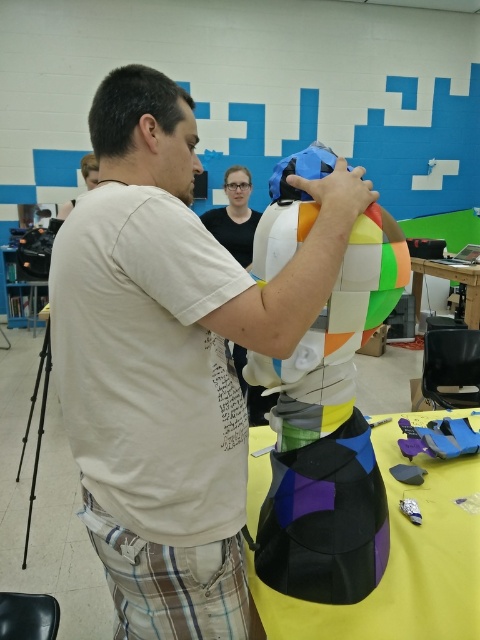
Measure the distance from matte white shirt at center to multicolored paper mache mask at center.

A distance of 6.90 inches exists between matte white shirt at center and multicolored paper mache mask at center.

Between point (230, 513) and point (372, 580), which one is positioned behind?

Point (372, 580)

Find the location of `matte white shirt at center`. matte white shirt at center is located at coordinates (170, 358).

The width and height of the screenshot is (480, 640). What do you see at coordinates (400, 563) in the screenshot?
I see `black fabric table at center` at bounding box center [400, 563].

Is black fabric table at center positioned at the back of yellow matte table at lower right?

That is False.

Identify the location of black fabric table at center. (400, 563).

Between multicolored paper mache mask at center and yellow matte table at lower right, which one has more height?

Standing taller between the two is multicolored paper mache mask at center.

Is multicolored paper mache mask at center wider than yellow matte table at lower right?

No, multicolored paper mache mask at center is not wider than yellow matte table at lower right.

Is point (257, 260) positioned in front of point (432, 273)?

Yes, point (257, 260) is in front of point (432, 273).

This screenshot has width=480, height=640. Identify the location of multicolored paper mache mask at center. (330, 435).